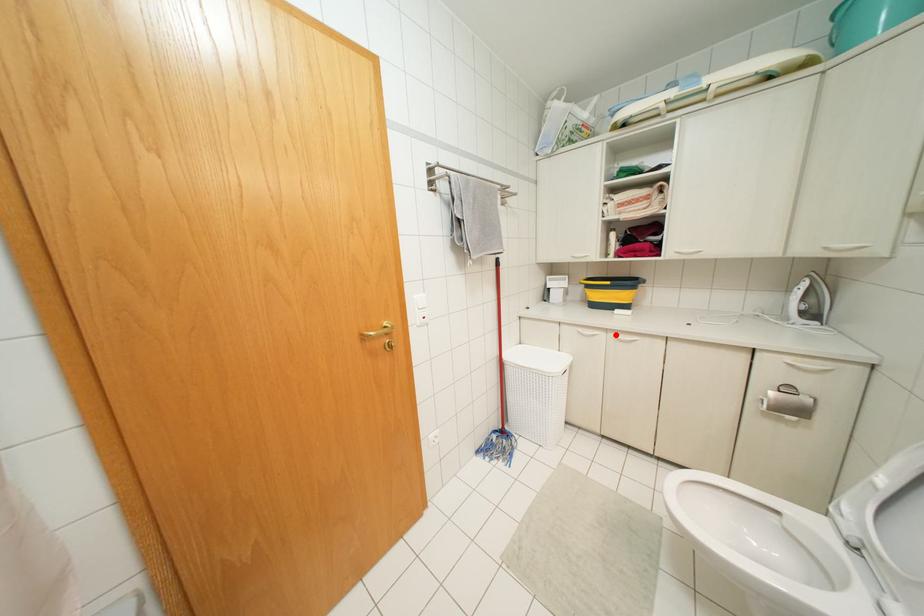
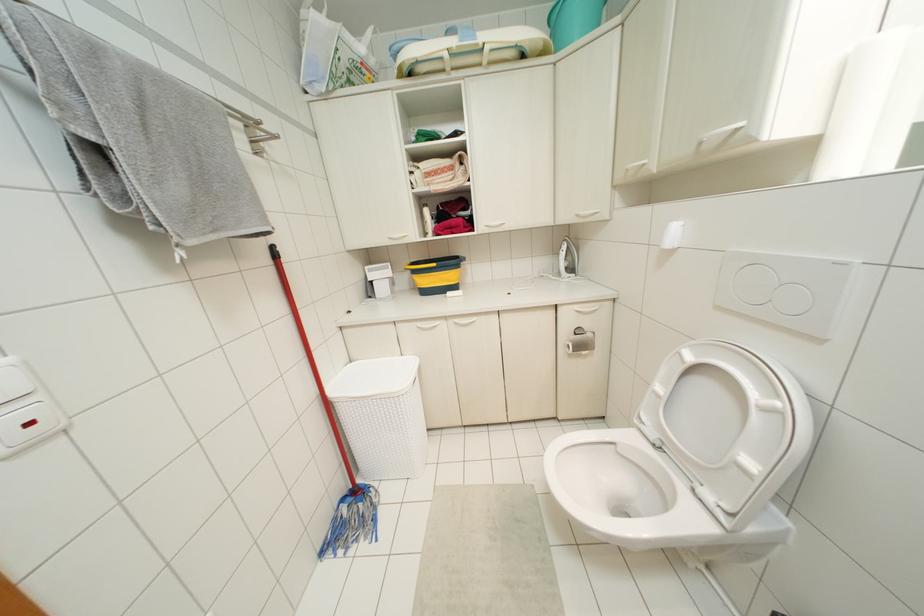
Locate, in the second image, the point that corresponds to the highlighted location in the first image.

(456, 320)